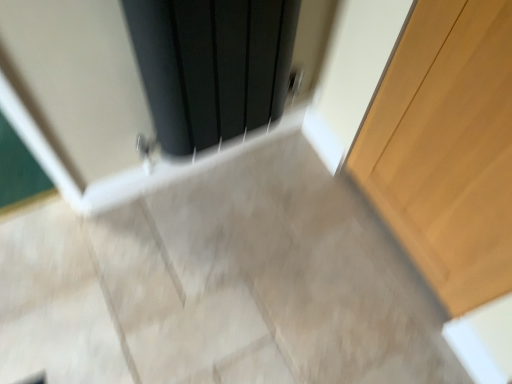
Question: Is light wood door at right positioned with its back to matte black radiator at upper center?

Choices:
 (A) yes
 (B) no

Answer: (B)

Question: Is the depth of light wood door at right less than that of matte black radiator at upper center?

Choices:
 (A) yes
 (B) no

Answer: (A)

Question: Is light wood door at right outside of matte black radiator at upper center?

Choices:
 (A) yes
 (B) no

Answer: (A)

Question: From a real-world perspective, is light wood door at right under matte black radiator at upper center?

Choices:
 (A) no
 (B) yes

Answer: (B)

Question: Can you confirm if light wood door at right is thinner than matte black radiator at upper center?

Choices:
 (A) yes
 (B) no

Answer: (A)

Question: Is the surface of light wood door at right in direct contact with matte black radiator at upper center?

Choices:
 (A) no
 (B) yes

Answer: (A)

Question: From a real-world perspective, is matte black radiator at upper center located beneath light wood door at right?

Choices:
 (A) yes
 (B) no

Answer: (B)

Question: Is matte black radiator at upper center not near light wood door at right?

Choices:
 (A) no
 (B) yes

Answer: (A)

Question: Is matte black radiator at upper center not inside light wood door at right?

Choices:
 (A) no
 (B) yes

Answer: (B)

Question: Is matte black radiator at upper center with light wood door at right?

Choices:
 (A) yes
 (B) no

Answer: (B)

Question: From the image's perspective, is matte black radiator at upper center above light wood door at right?

Choices:
 (A) no
 (B) yes

Answer: (B)

Question: Can you confirm if matte black radiator at upper center is smaller than light wood door at right?

Choices:
 (A) yes
 (B) no

Answer: (B)

Question: From the image's perspective, relative to matte black radiator at upper center, is light wood door at right above or below?

Choices:
 (A) below
 (B) above

Answer: (A)